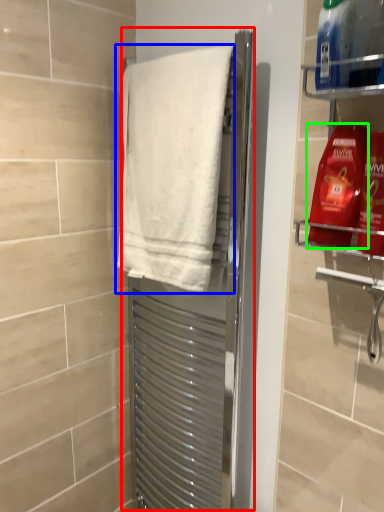
Question: Based on their relative distances, which object is farther from screen door (highlighted by a red box)? Choose from towel (highlighted by a blue box) and cleaning product (highlighted by a green box).

Choices:
 (A) towel
 (B) cleaning product

Answer: (B)